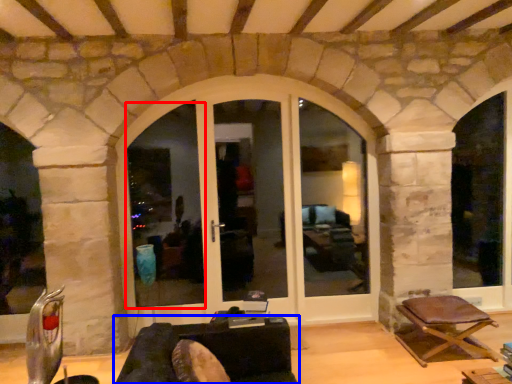
Question: Which point is further to the camera, window frame (highlighted by a red box) or studio couch (highlighted by a blue box)?

Choices:
 (A) window frame
 (B) studio couch

Answer: (A)